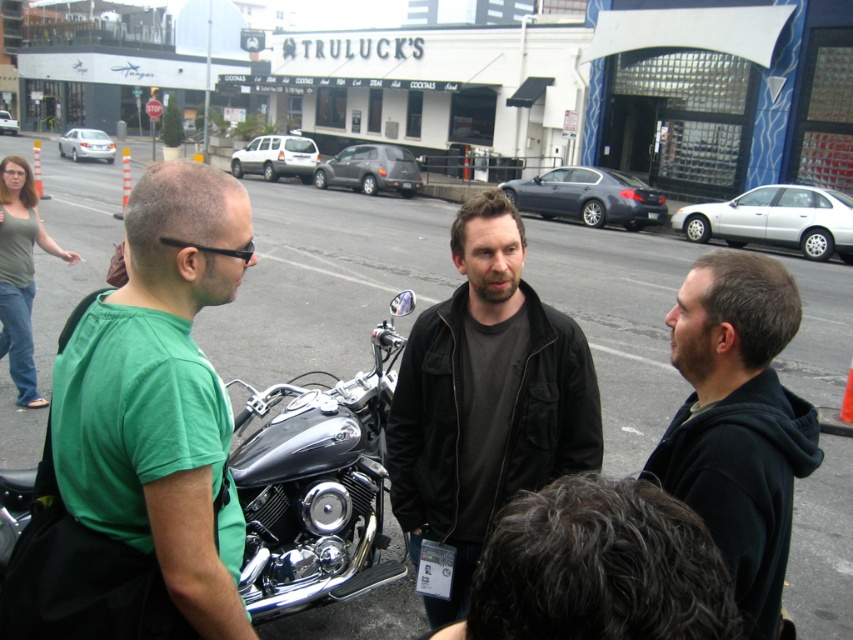
Question: Which is farther from the shiny chrome motorcycle at center?

Choices:
 (A) green matte t-shirt at left
 (B) black hoodie at right

Answer: (B)

Question: Can you confirm if shiny chrome motorcycle at center is positioned to the right of black hoodie at right?

Choices:
 (A) yes
 (B) no

Answer: (B)

Question: Is the position of dark gray fabric jacket at center less distant than that of black hoodie at right?

Choices:
 (A) yes
 (B) no

Answer: (B)

Question: Which point is closer to the camera taking this photo?

Choices:
 (A) (292, 467)
 (B) (755, 280)
 (C) (219, 636)

Answer: (C)

Question: Where is green matte t-shirt at left located in relation to black hoodie at right in the image?

Choices:
 (A) above
 (B) below

Answer: (A)

Question: Which point is closer to the camera?

Choices:
 (A) (788, 500)
 (B) (422, 596)
 (C) (334, 419)
 (D) (199, 458)

Answer: (D)